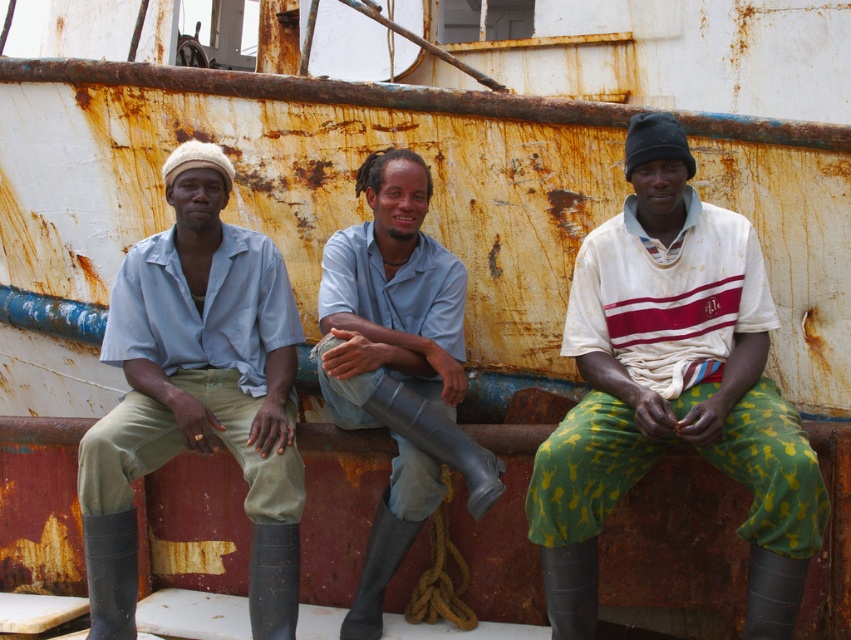
Based on the photo, you are a photographer trying to capture the man in the center of the scene. You notice the white striped shirt at center and the gray rubber boots at center. Which of these two items will appear bigger in your photo?

The white striped shirt at center is larger in size than the gray rubber boots at center, so it will appear bigger in the photo.